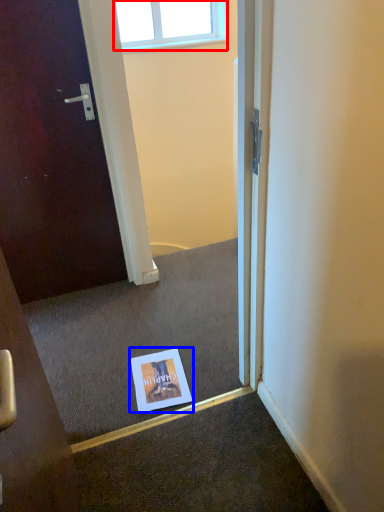
Question: Which object is closer to the camera taking this photo, window (highlighted by a red box) or flyer (highlighted by a blue box)?

Choices:
 (A) window
 (B) flyer

Answer: (B)